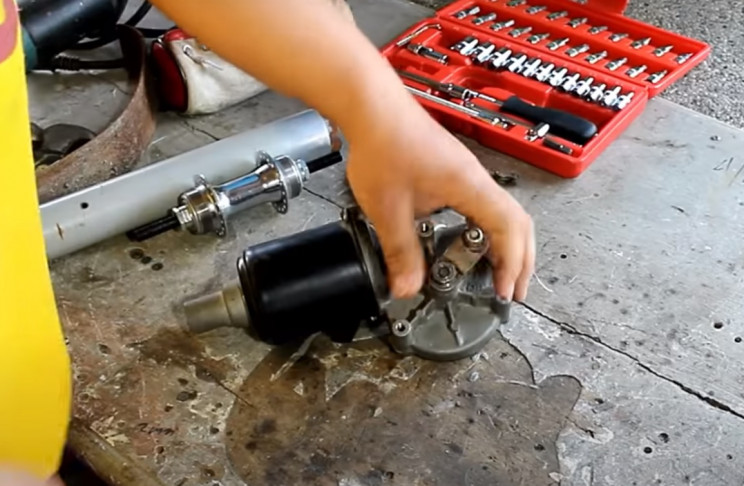
Find the location of a particular element. The width and height of the screenshot is (744, 486). small red and white pouch is located at coordinates (193, 78).